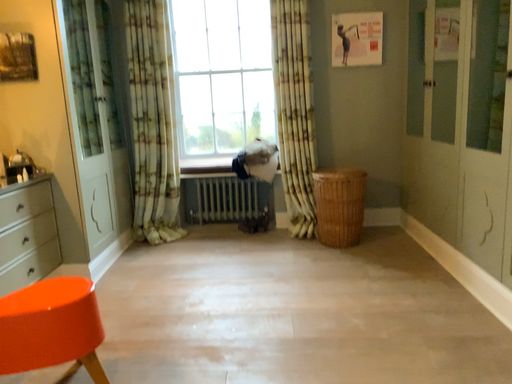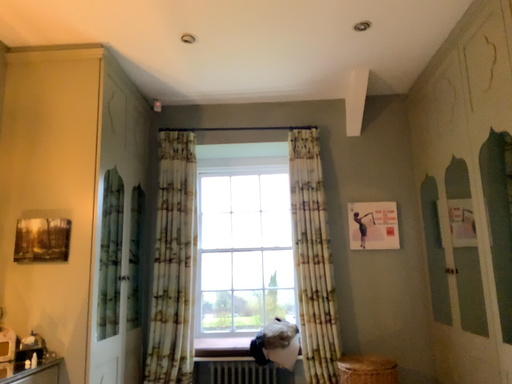
Question: Which way did the camera rotate in the video?

Choices:
 (A) rotated upward
 (B) rotated downward

Answer: (A)